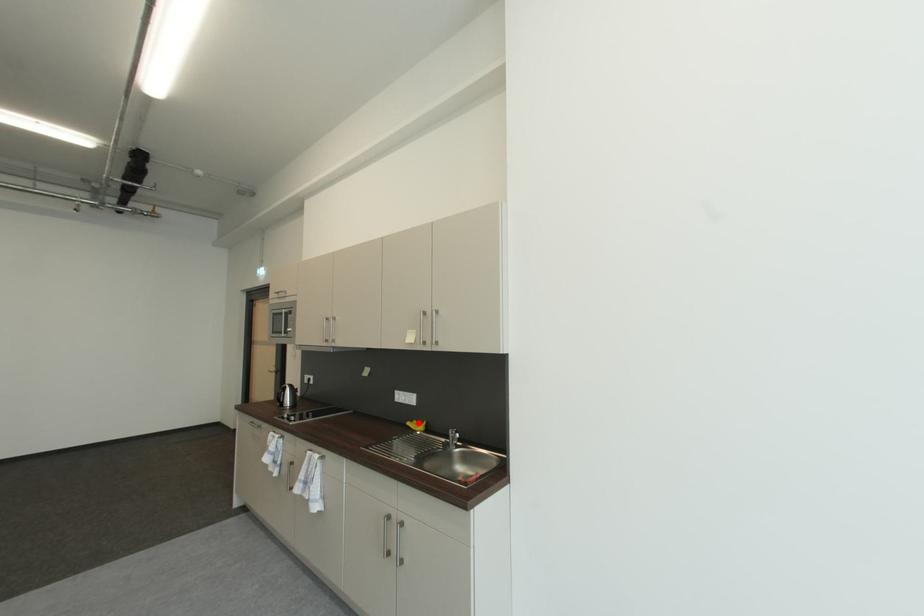
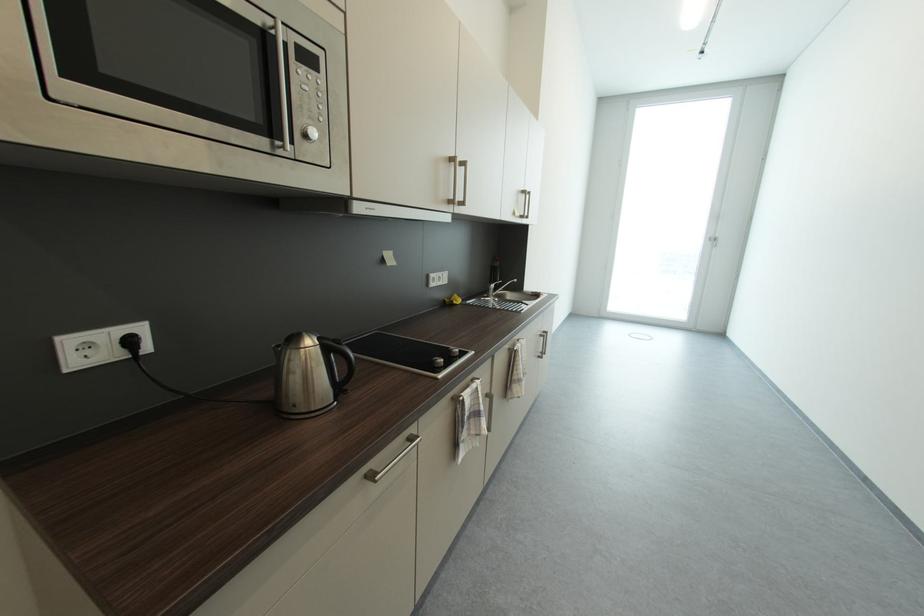
The point at the highlighted location is marked in the first image. Where is the corresponding point in the second image?

(453, 302)